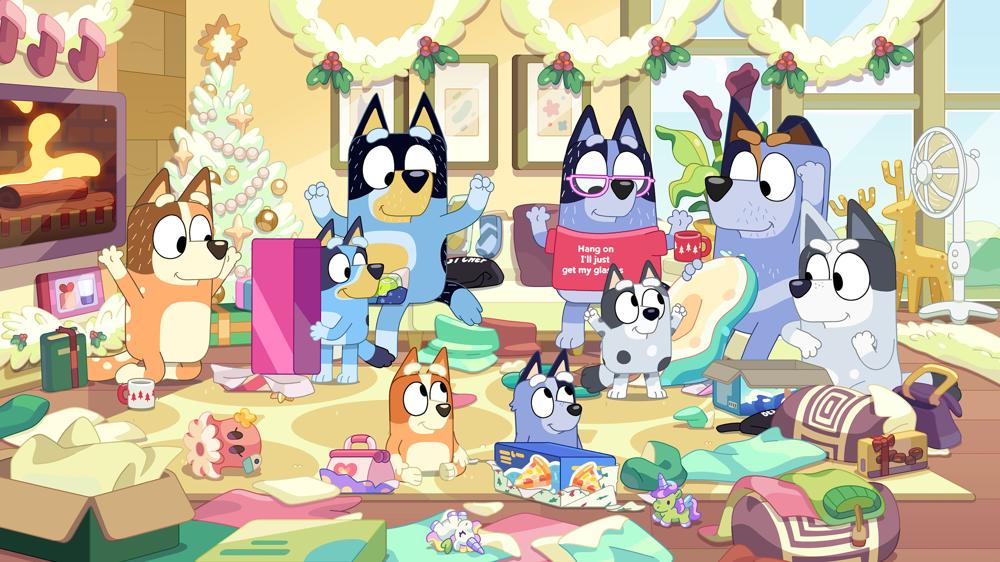
Identify the location of mug. tap(133, 394), tap(684, 244).